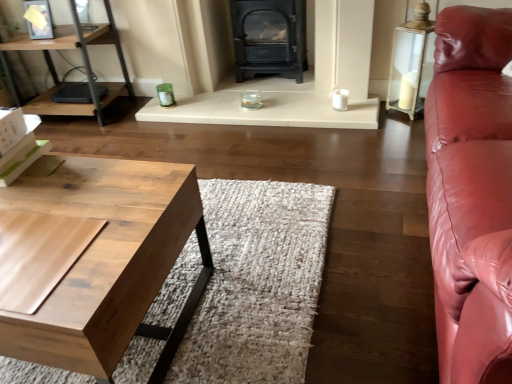
Question: Considering their positions, is wooden desk at left located in front of or behind matte black wood burning stove at center?

Choices:
 (A) behind
 (B) front

Answer: (B)

Question: Is wooden desk at left inside or outside of matte black wood burning stove at center?

Choices:
 (A) inside
 (B) outside

Answer: (B)

Question: Considering the real-world distances, which object is closest to the natural wood coffee table at lower left?

Choices:
 (A) wooden desk at left
 (B) matte black wood burning stove at center
 (C) black cast iron fireplace at center

Answer: (C)

Question: Estimate the real-world distances between objects in this image. Which object is closer to the black cast iron fireplace at center?

Choices:
 (A) matte black wood burning stove at center
 (B) wooden desk at left
 (C) natural wood coffee table at lower left

Answer: (A)